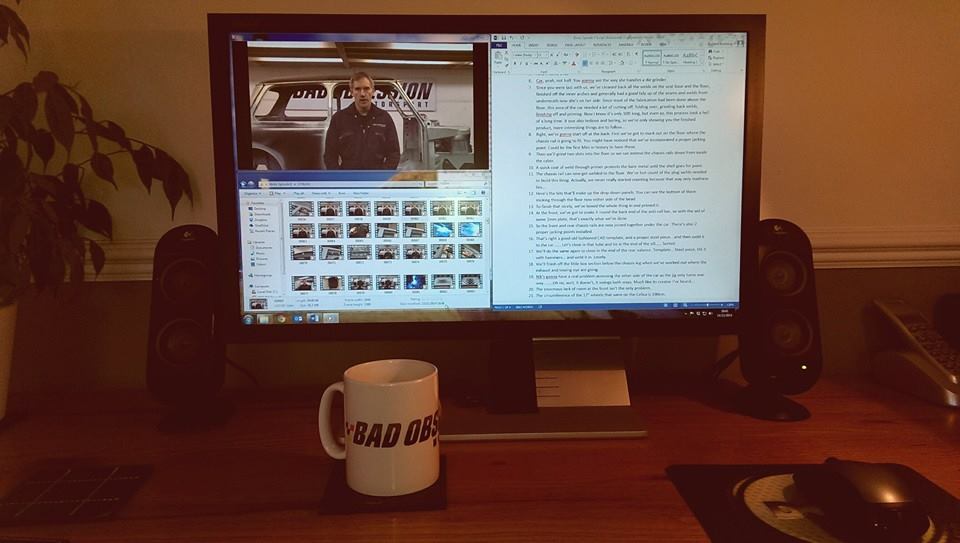
In order to click on computer monitor in this screenshot , I will do `click(219, 26)`.